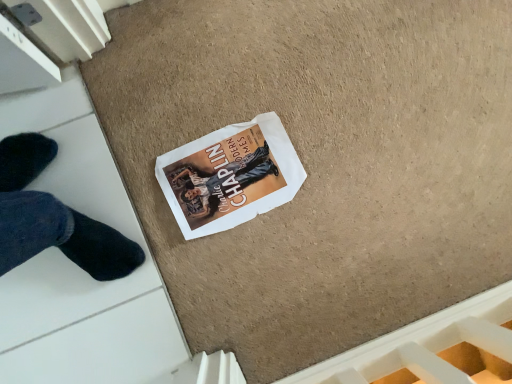
Identify the location of vacant area on top of white paper magazine at center (from a real-world perspective). Image resolution: width=512 pixels, height=384 pixels. (232, 179).